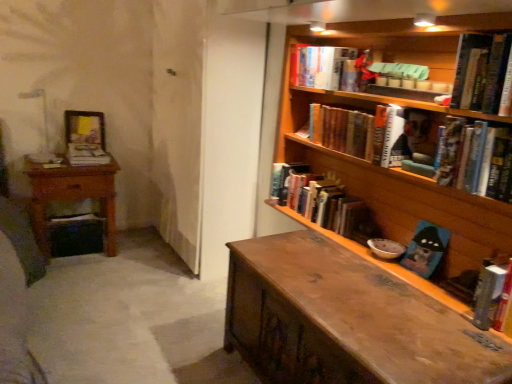
Question: Does wooden bookshelf at upper right come in front of hardcover book at right, marked as the seventh book in a left-to-right arrangement?

Choices:
 (A) no
 (B) yes

Answer: (B)

Question: Does wooden bookshelf at upper right lie behind hardcover book at right, arranged as the first book when viewed from the right?

Choices:
 (A) yes
 (B) no

Answer: (B)

Question: From the image's perspective, is wooden bookshelf at upper right below hardcover book at right, arranged as the first book when viewed from the right?

Choices:
 (A) yes
 (B) no

Answer: (B)

Question: Is wooden bookshelf at upper right thinner than hardcover book at right, arranged as the first book when viewed from the right?

Choices:
 (A) no
 (B) yes

Answer: (A)

Question: Is wooden bookshelf at upper right turned away from hardcover book at right, marked as the seventh book in a left-to-right arrangement?

Choices:
 (A) yes
 (B) no

Answer: (B)

Question: Is wooden picture frame at upper left bigger or smaller than wooden bookshelf at upper right?

Choices:
 (A) big
 (B) small

Answer: (B)

Question: Is wooden picture frame at upper left taller or shorter than wooden bookshelf at upper right?

Choices:
 (A) tall
 (B) short

Answer: (B)

Question: Is wooden picture frame at upper left wider or thinner than wooden bookshelf at upper right?

Choices:
 (A) thin
 (B) wide

Answer: (A)

Question: From the image's perspective, is wooden picture frame at upper left located above or below wooden bookshelf at upper right?

Choices:
 (A) below
 (B) above

Answer: (B)

Question: In terms of size, does hardcover book at upper right, which ranks as the sixth book in left-to-right order, appear bigger or smaller than wooden picture frame at upper left?

Choices:
 (A) big
 (B) small

Answer: (A)

Question: Is point (501, 49) closer or farther from the camera than point (100, 142)?

Choices:
 (A) closer
 (B) farther

Answer: (A)

Question: Considering the relative positions of hardcover book at upper right, which appears as the 2th book when viewed from the right, and wooden picture frame at upper left in the image provided, is hardcover book at upper right, which appears as the 2th book when viewed from the right, to the left or to the right of wooden picture frame at upper left?

Choices:
 (A) right
 (B) left

Answer: (A)

Question: Considering the positions of hardcover book at upper right, which ranks as the sixth book in left-to-right order, and wooden picture frame at upper left in the image, is hardcover book at upper right, which ranks as the sixth book in left-to-right order, wider or thinner than wooden picture frame at upper left?

Choices:
 (A) thin
 (B) wide

Answer: (B)

Question: From the image's perspective, relative to hardcover book at upper right, the 4th book viewed from the right, is wooden picture frame at upper left above or below?

Choices:
 (A) below
 (B) above

Answer: (B)

Question: From a real-world perspective, relative to hardcover book at upper right, the fourth book from the left, is wooden picture frame at upper left vertically above or below?

Choices:
 (A) above
 (B) below

Answer: (B)